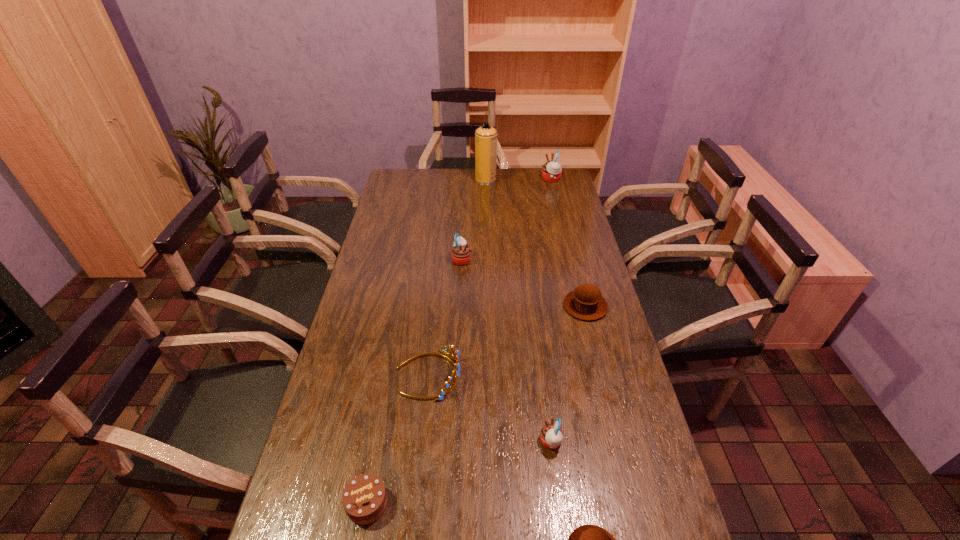
Where is `vacant space situated 0.120m on the front-facing side of the smallest pink muffin`? vacant space situated 0.120m on the front-facing side of the smallest pink muffin is located at coordinates (493, 442).

The height and width of the screenshot is (540, 960). In order to click on free region located on the front-facing side of the smallest pink muffin in this screenshot , I will do `click(420, 442)`.

The image size is (960, 540). I want to click on free space located 0.120m on the front-facing side of the smallest pink muffin, so click(x=493, y=442).

The width and height of the screenshot is (960, 540). Identify the location of free spot located 0.330m on the back of the fifth nearest object. (567, 237).

The image size is (960, 540). In order to click on vacant space situated on the right of the second nearest object in this screenshot , I will do `click(426, 503)`.

Image resolution: width=960 pixels, height=540 pixels. In order to click on aerosol can that is at the far edge in this screenshot , I will do `click(485, 136)`.

Find the location of a particular element. The height and width of the screenshot is (540, 960). muffin present at the far edge is located at coordinates (551, 171).

This screenshot has width=960, height=540. In order to click on object that is at the left edge in this screenshot , I will do `click(364, 499)`.

This screenshot has width=960, height=540. What are the coordinates of `object at the far right corner` in the screenshot? It's located at (551, 171).

Identify the location of free space at the far edge of the desktop. The image size is (960, 540). (509, 173).